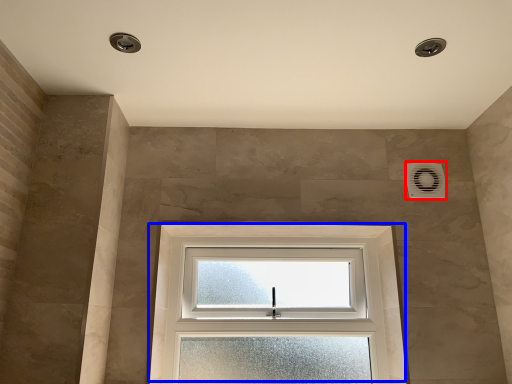
Question: Which of the following is the farthest to the observer, air conditioning (highlighted by a red box) or window (highlighted by a blue box)?

Choices:
 (A) air conditioning
 (B) window

Answer: (A)